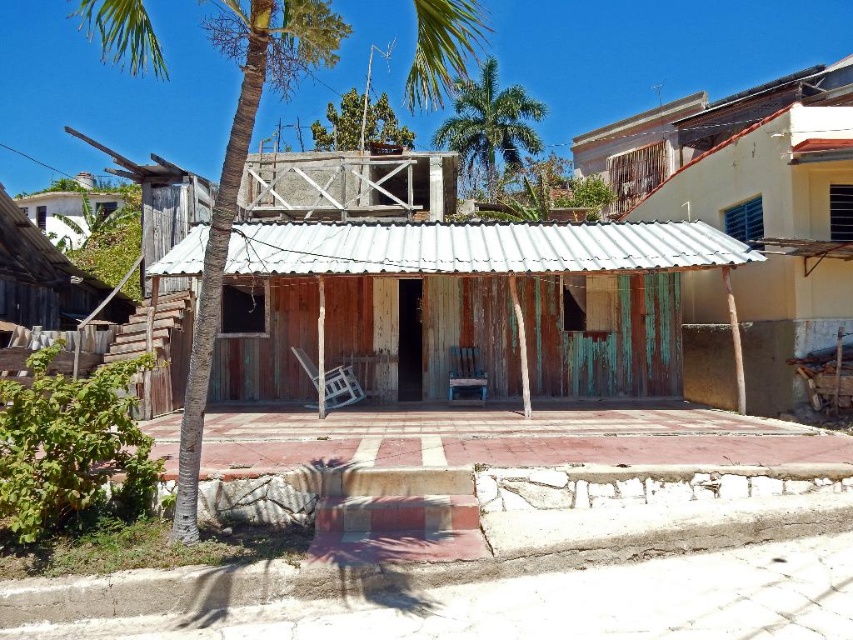
Consider the image. You are standing on the porch of the rustic wooden structure and notice two green leafy palm trees. Which one, the green leafy palm tree at center or the green leafy palm tree at upper center, appears bigger in size?

The green leafy palm tree at center is larger in size compared to the green leafy palm tree at upper center.

You are standing on the ground in front of the green weathered wood hut at center and want to see the green leafy palm tree at upper center. Can you see it without moving your head?

The green leafy palm tree at upper center is behind the green weathered wood hut at center, so you cannot see it without moving your head.

You are standing on the porch of the green weathered wood hut at center and want to sit in the wooden chair that is under the green leafy palm tree at center. Which direction should you walk to reach the chair?

You should walk to the left to reach the wooden chair under the green leafy palm tree at center because the green weathered wood hut at center is to the right of the palm tree, so moving left from the hut will bring you towards the tree and the chair.